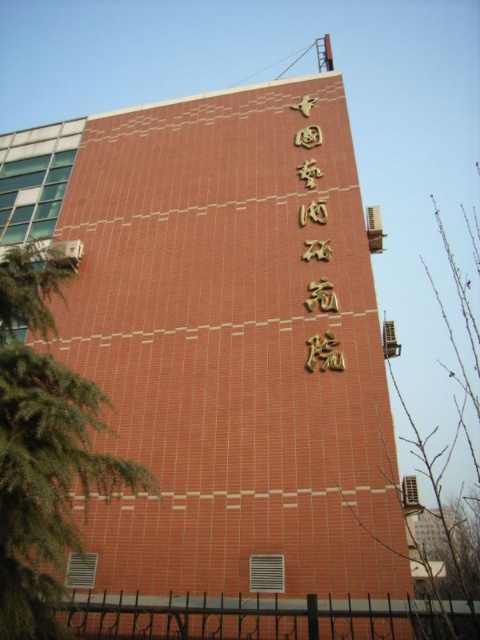
You are standing in front of the building and see two points marked on the facade. The first point is at coordinate point (2, 531) and the second point is at coordinate point (456, 536). Which point is closer to you?

Point (2, 531) is in front of point (456, 536), so the first point is closer to you.

You are standing in front of the building and want to take a photo of the golden Chinese characters. Where should you position yourself relative to the green leafy tree at center to ensure the characters are fully visible in the frame?

To ensure the golden Chinese characters are fully visible in the frame, you should position yourself to the left or right of the green leafy tree at center since the characters are centrally located on the building and the tree is positioned at the center as well. This will allow the characters to be in the background without obstruction.

You are standing in front of the building and notice two green leafy trees. Which tree, the green leafy tree at left or the green leafy tree at center, is taller?

The green leafy tree at center is taller than the green leafy tree at left.